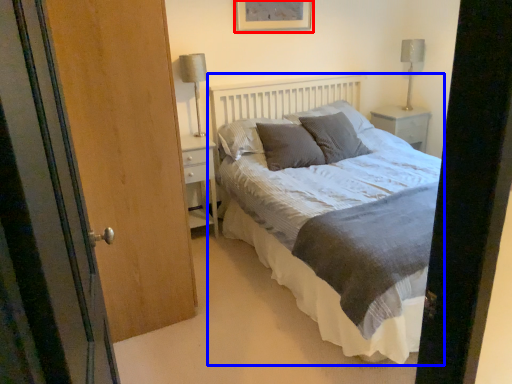
Question: Among these objects, which one is farthest to the camera, picture frame (highlighted by a red box) or bed (highlighted by a blue box)?

Choices:
 (A) picture frame
 (B) bed

Answer: (A)